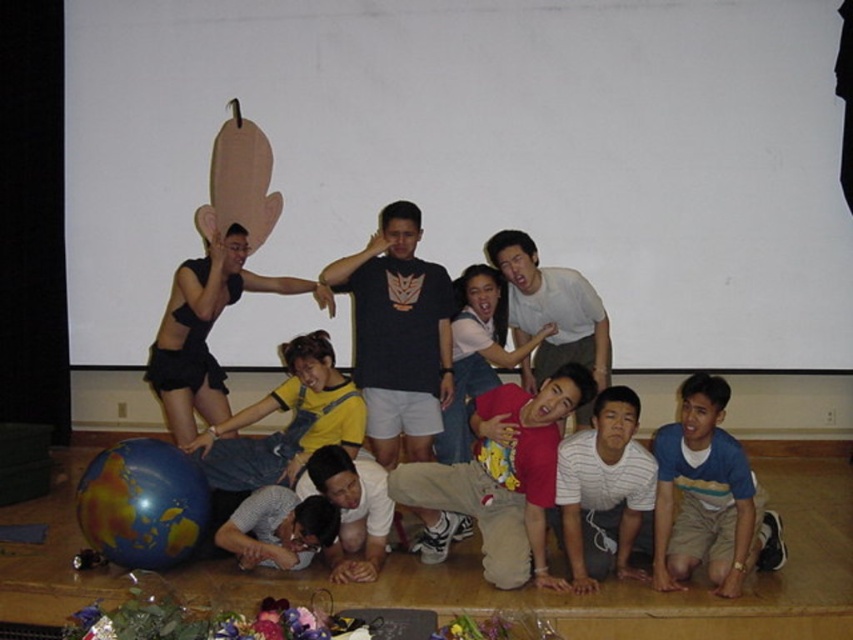
Between denim overalls at center and multicolored glossy globe at lower left, which one has less height?

multicolored glossy globe at lower left is shorter.

Does denim overalls at center lie behind multicolored glossy globe at lower left?

Yes, it is behind multicolored glossy globe at lower left.

Find the location of a particular element. The width and height of the screenshot is (853, 640). denim overalls at center is located at coordinates (206, 330).

Between point (488, 392) and point (126, 440), which one is positioned behind?

The point (126, 440) is more distant.

Does point (463, 472) come in front of point (148, 547)?

That is False.

Which is behind, point (511, 449) or point (103, 550)?

Positioned behind is point (103, 550).

I want to click on matte red shirt at center, so click(503, 476).

Describe the element at coordinates (706, 497) in the screenshot. The width and height of the screenshot is (853, 640). I see `blue striped shirt at lower right` at that location.

Measure the distance from blue striped shirt at lower right to denim overalls at center.

A distance of 2.27 meters exists between blue striped shirt at lower right and denim overalls at center.

Which is behind, point (712, 497) or point (175, 307)?

Point (175, 307)

Where is `blue striped shirt at lower right`? blue striped shirt at lower right is located at coordinates (706, 497).